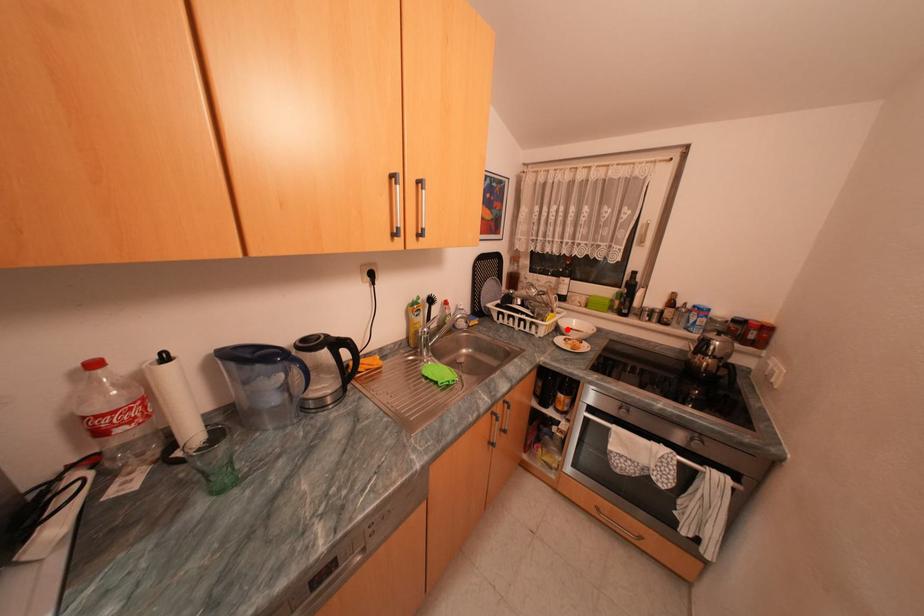
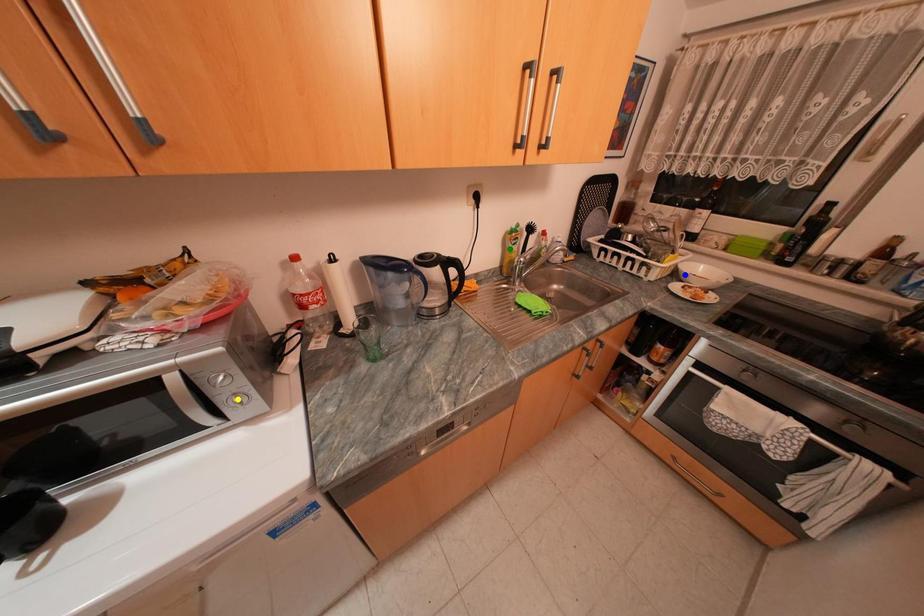
Question: I am providing you with two images of the same scene from different viewpoints. A red point is marked on the first image. You are given multiple points on the second image. Can you choose the point in image 2 that corresponds to the point in image 1?

Choices:
 (A) green point
 (B) blue point
 (C) yellow point

Answer: (B)